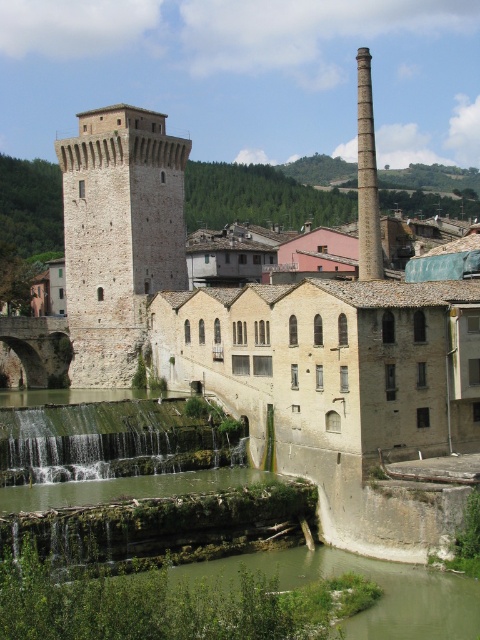
Question: Is smooth stone chimney at upper center smaller than smooth gray chimney at upper right?

Choices:
 (A) yes
 (B) no

Answer: (A)

Question: Is smooth stone chimney at upper center below smooth gray chimney at upper right?

Choices:
 (A) yes
 (B) no

Answer: (A)

Question: Observing the image, what is the correct spatial positioning of smooth stone chimney at upper center in reference to smooth gray chimney at upper right?

Choices:
 (A) above
 (B) below

Answer: (B)

Question: Which point appears farthest from the camera in this image?

Choices:
 (A) (360, 164)
 (B) (132, 369)

Answer: (B)